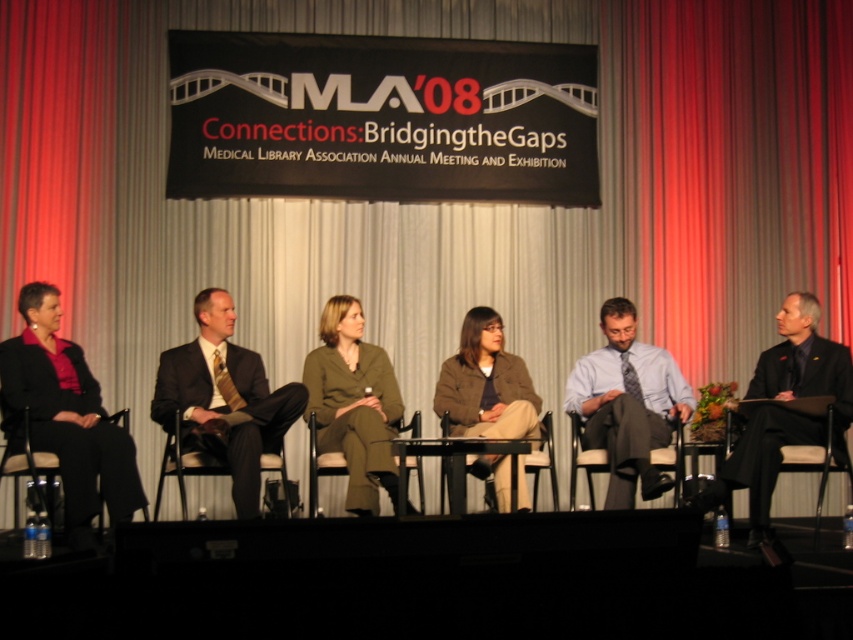
You are sitting in the audience at the MLA 2008 panel discussion and want to point out two specific points on the stage. Which of the two points, point (291,396) or point (575,456), is closer to you?

Point (291,396) is closer to the viewer than point (575,456).

Where is the dark brown pinstripe suit at center located in the image?

The dark brown pinstripe suit at center is located at coordinates point (x=227, y=412).

You are a photographer at the MLA 2008 event. You need to position a spotlight so that it illuminates both the point at coordinates point (610,340) and point (527,460). Given that the spotlight can only be placed in front of the stage, which point should you aim the spotlight towards first to ensure both are lit?

Since point (610,340) is behind point (527,460), you should aim the spotlight towards point (527,460) first. This way, the light will reach it directly, and the light will also naturally illuminate the point behind it at (610,340) as well.